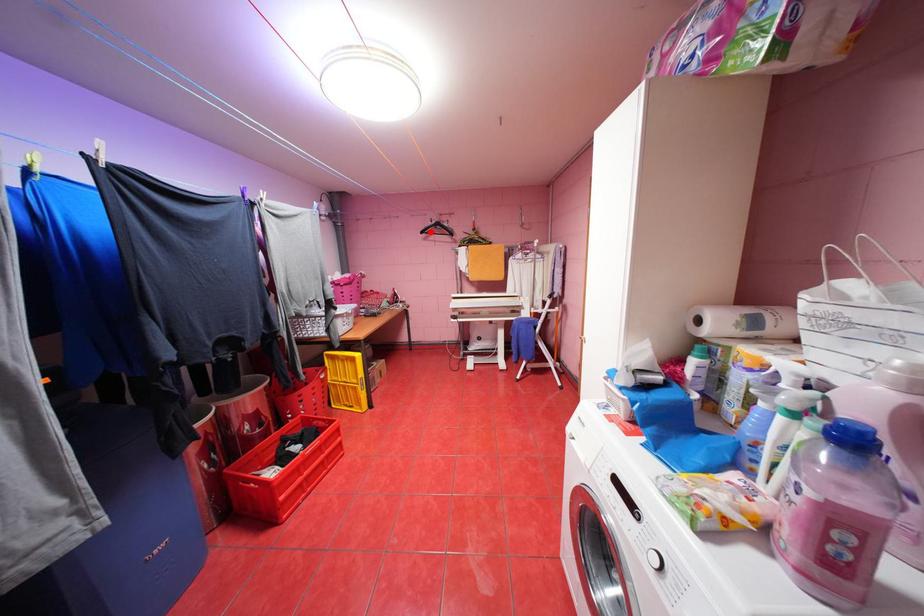
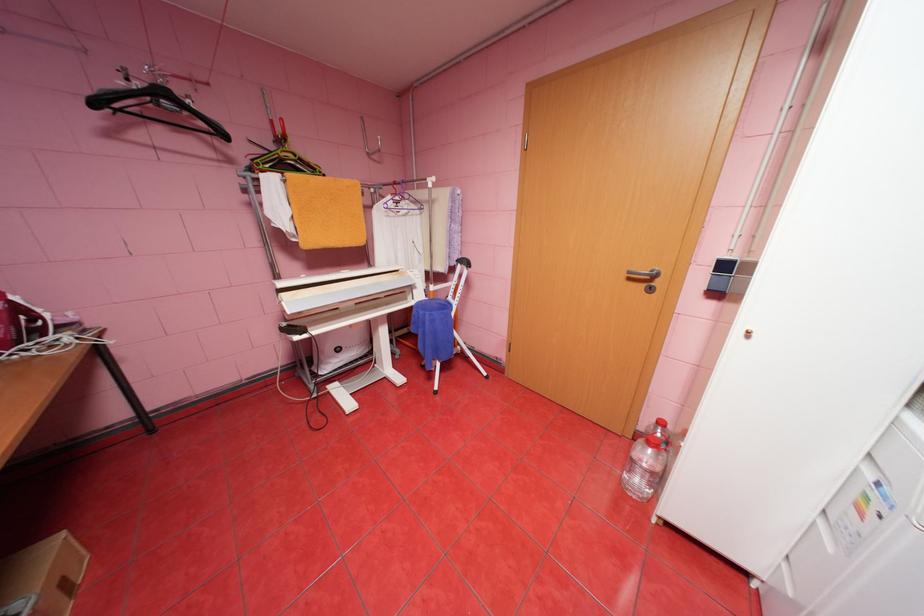
Locate, in the second image, the point that corresponds to the highlighted location in the first image.

(103, 103)